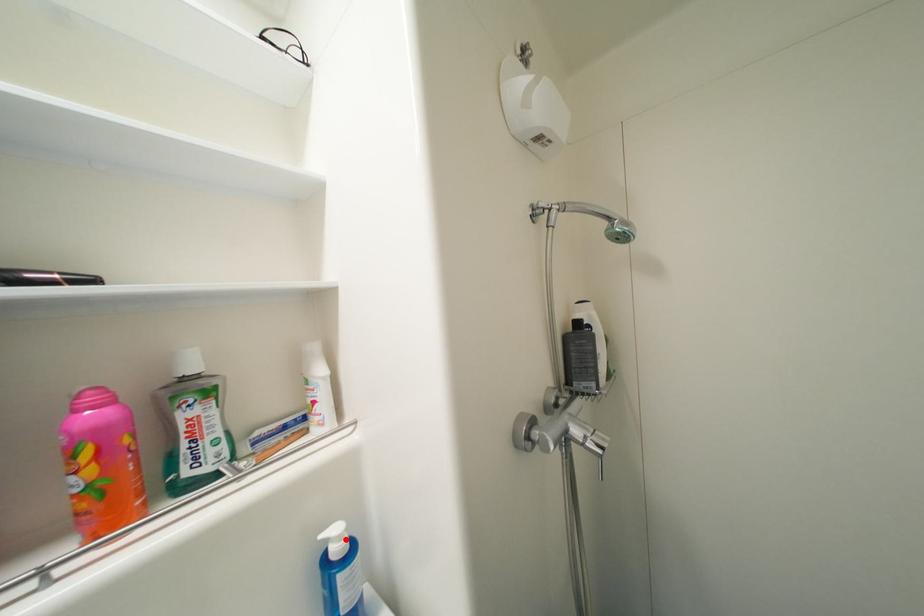
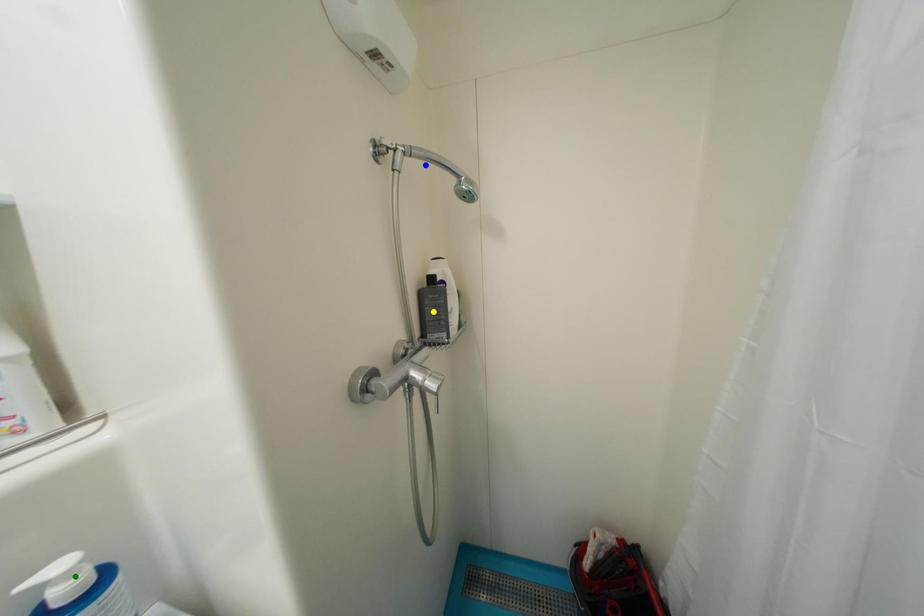
Question: I am providing you with two images of the same scene from different viewpoints. A red point is marked on the first image. You are given multiple points on the second image. In image 2, which mark is for the same physical point as the one in image 1?

Choices:
 (A) green point
 (B) blue point
 (C) yellow point

Answer: (A)